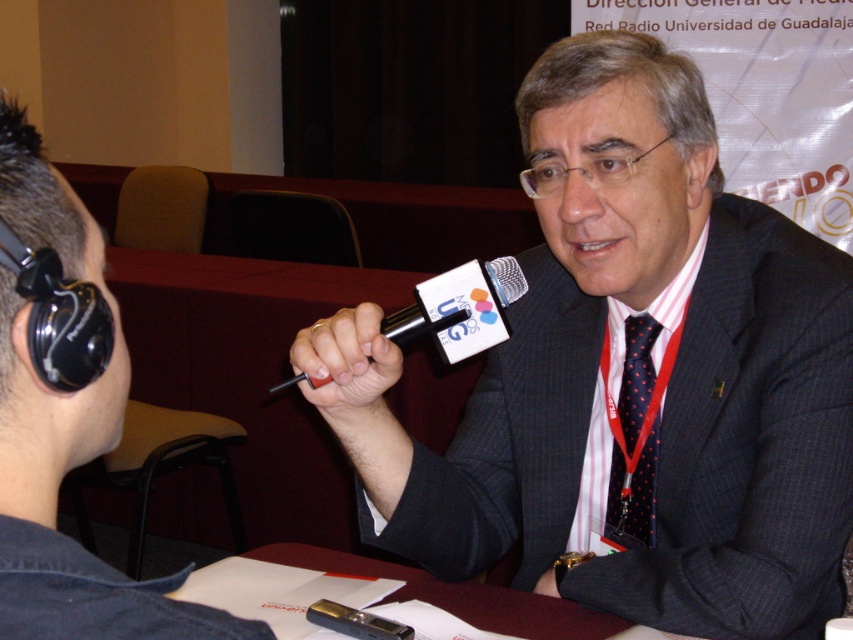
Is black textured suit at center closer to camera compared to matte black microphone at center?

No, it is not.

Is point (561, 72) positioned before point (126, 621)?

No, it is behind (126, 621).

Who is more forward, [770,540] or [51,252]?

Point [51,252] is more forward.

Image resolution: width=853 pixels, height=640 pixels. In order to click on black textured suit at center in this screenshot , I will do `click(654, 369)`.

How much distance is there between black plastic microphone at center and black rubber microphone at center?

black plastic microphone at center and black rubber microphone at center are 2.56 inches apart from each other.

Does black plastic microphone at center appear on the left side of black rubber microphone at center?

In fact, black plastic microphone at center is to the right of black rubber microphone at center.

Who is more distant from viewer, (399, 317) or (312, 326)?

Positioned behind is point (399, 317).

Locate an element on the screen. black plastic microphone at center is located at coordinates (460, 308).

Which is more to the left, black plastic microphone at center or dark blue dotted tie at center?

black plastic microphone at center

Which of these two, black plastic microphone at center or dark blue dotted tie at center, stands shorter?

black plastic microphone at center is shorter.

Between point (483, 276) and point (648, 368), which one is positioned behind?

Point (648, 368)

The height and width of the screenshot is (640, 853). Identify the location of black plastic microphone at center. (460, 308).